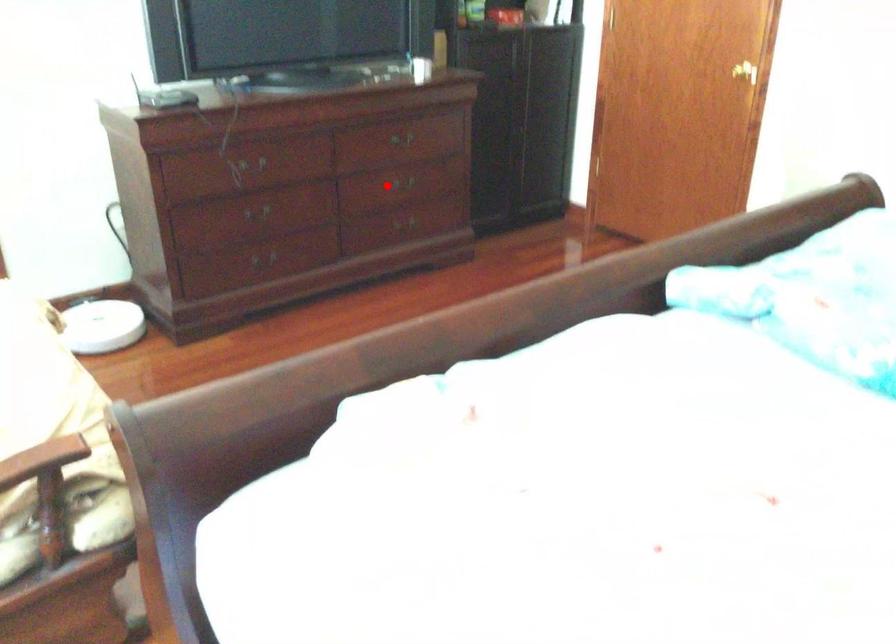
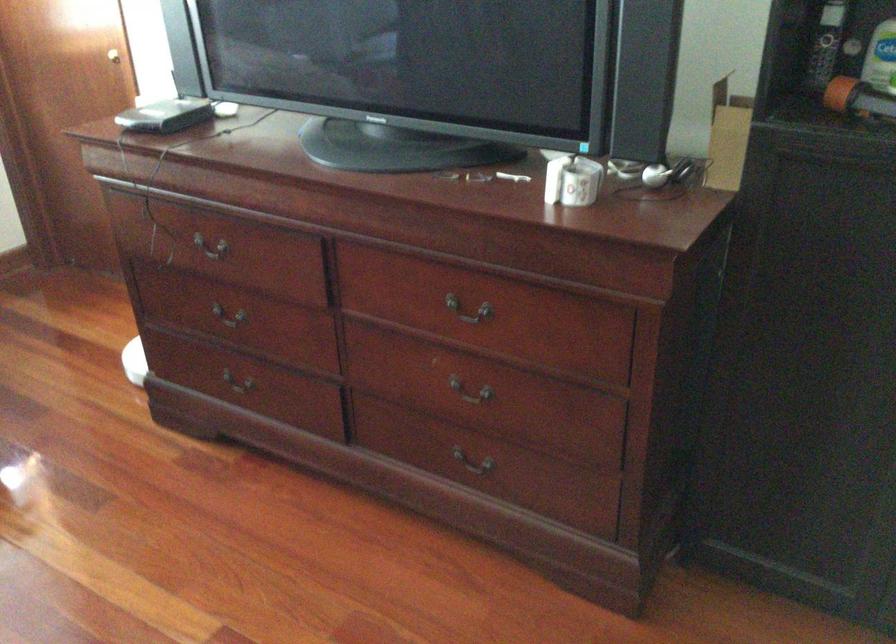
Find the pixel in the second image that matches the highlighted location in the first image.

(470, 392)